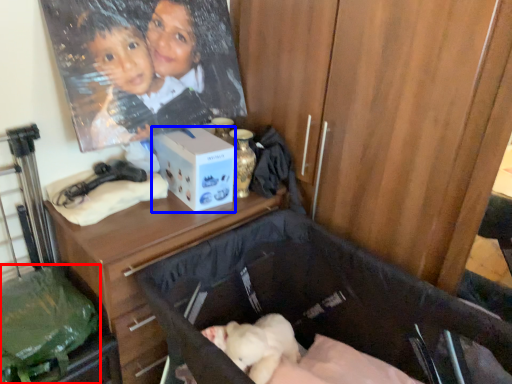
Question: Which point is closer to the camera, waste (highlighted by a red box) or box (highlighted by a blue box)?

Choices:
 (A) waste
 (B) box

Answer: (A)